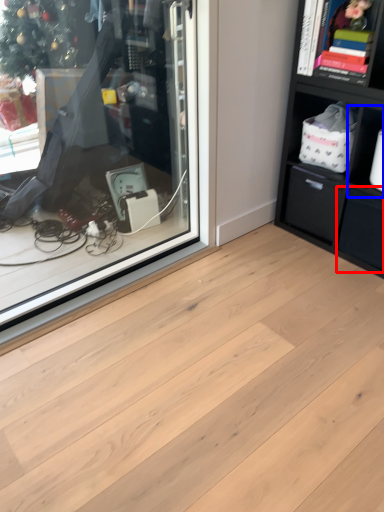
Question: Which point is closer to the camera, drawer (highlighted by a red box) or cabinet (highlighted by a blue box)?

Choices:
 (A) drawer
 (B) cabinet

Answer: (B)